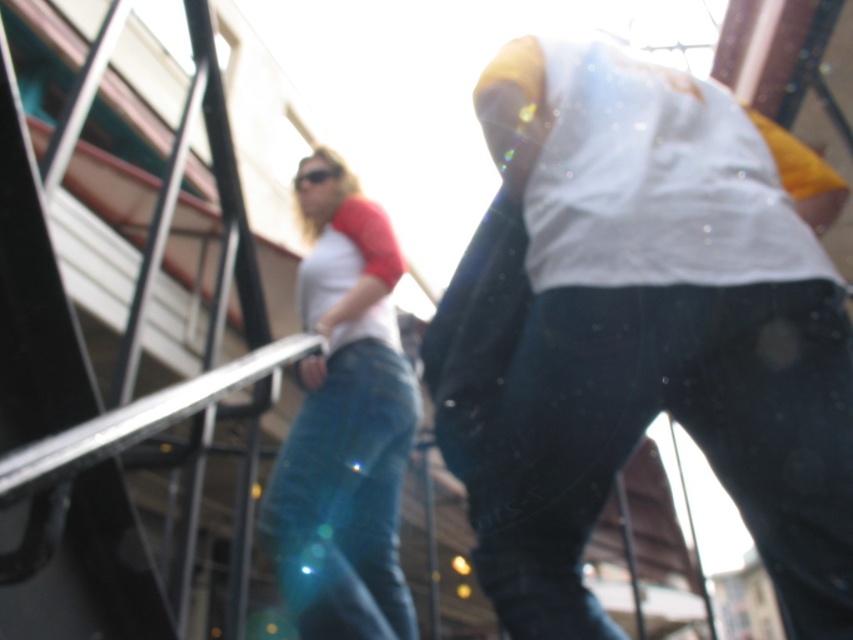
You are standing in the plaza and want to reach a specific point marked at coordinates (538, 451). If your arms can reach up to 36 inches, can you comfortably reach that point without moving your feet?

The distance of point (538, 451) from viewer is 35.95 inches, so yes, you can comfortably reach it since it is within your 36 inches reach range.